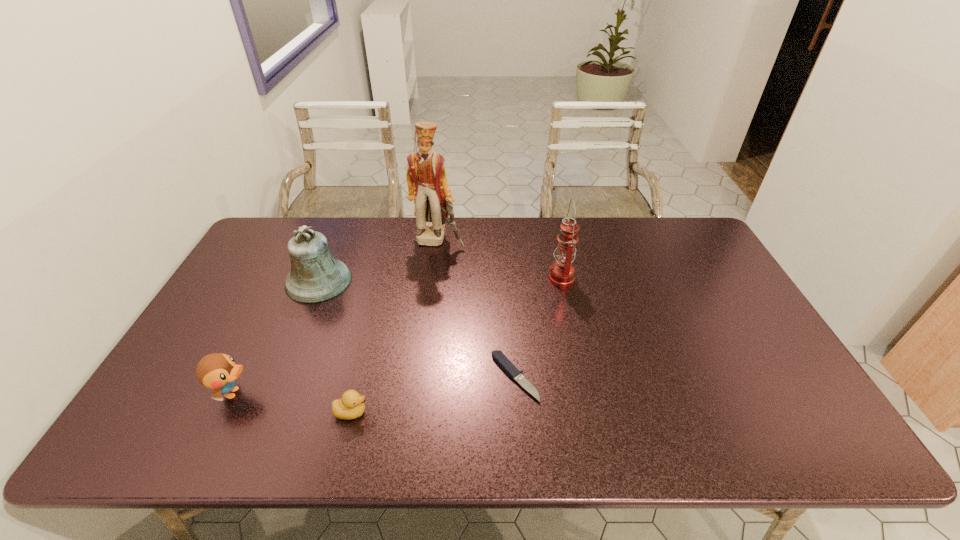
I want to click on empty location between the shortest object and the bell, so click(x=417, y=329).

Where is `empty space between the second shortest object and the duck`? empty space between the second shortest object and the duck is located at coordinates (293, 402).

The height and width of the screenshot is (540, 960). I want to click on vacant area that lies between the shortest object and the second shortest object, so click(x=433, y=395).

At what (x,y) coordinates should I click in order to perform the action: click on vacant space that's between the oil lamp and the third shortest object. Please return your answer as a coordinate pair (x, y). This screenshot has height=540, width=960. Looking at the image, I should click on (397, 335).

What are the coordinates of `vacant area that lies between the duck and the tallest object` in the screenshot? It's located at (336, 316).

Identify which object is located as the fifth nearest to the duckling. Please provide its 2D coordinates. Your answer should be formatted as a tuple, i.e. [(x, y)], where the tuple contains the x and y coordinates of a point satisfying the conditions above.

[(562, 272)]

Where is `object that ranks as the fourth closest to the rightmost object`? This screenshot has width=960, height=540. object that ranks as the fourth closest to the rightmost object is located at coordinates (316, 276).

At what (x,y) coordinates should I click in order to perform the action: click on free location that satisfies the following two spatial constraints: 1. on the front-facing side of the third object from right to left; 2. on the front-facing side of the third shortest object. Please return your answer as a coordinate pair (x, y). Looking at the image, I should click on (420, 393).

You are a GUI agent. You are given a task and a screenshot of the screen. Output one action in this format:
    pyautogui.click(x=<x>, y=<y>)
    Task: Click on the vacant space that satisfies the following two spatial constraints: 1. on the front-facing side of the nutcracker; 2. on the front-facing side of the duck
    This screenshot has width=960, height=540.
    Given the screenshot: What is the action you would take?
    pyautogui.click(x=420, y=393)